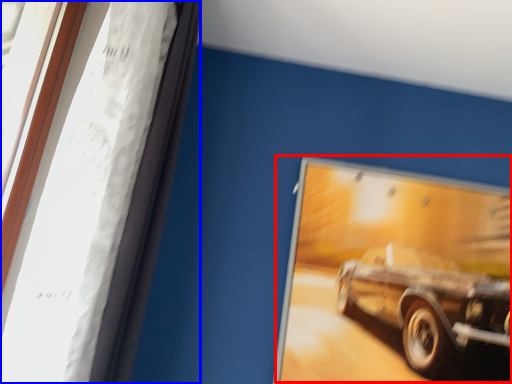
Question: Which point is closer to the camera, car (highlighted by a red box) or window frame (highlighted by a blue box)?

Choices:
 (A) car
 (B) window frame

Answer: (B)